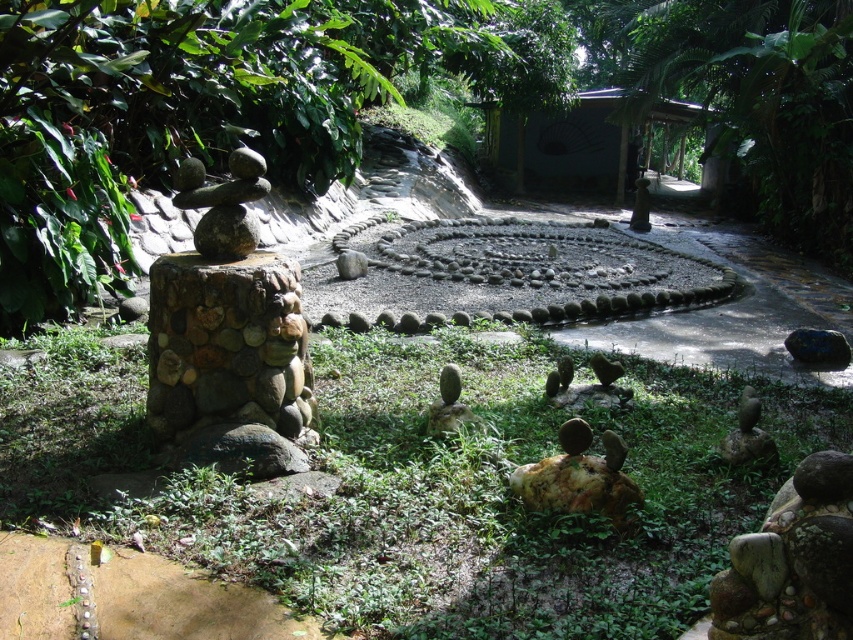
Between rustic stone sculpture at left and smooth brown rock stack at center-left, which one appears on the right side from the viewer's perspective?

From the viewer's perspective, rustic stone sculpture at left appears more on the right side.

Locate an element on the screen. The width and height of the screenshot is (853, 640). rustic stone sculpture at left is located at coordinates (228, 336).

Identify the location of rustic stone sculpture at left. The height and width of the screenshot is (640, 853). (228, 336).